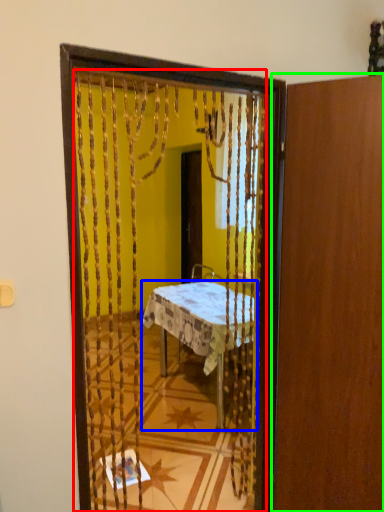
Question: Which object is the farthest from mirror (highlighted by a red box)? Choose among these: desk (highlighted by a blue box) or door (highlighted by a green box).

Choices:
 (A) desk
 (B) door

Answer: (B)